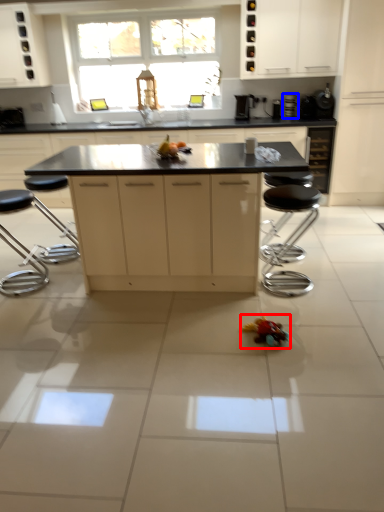
Question: Which object appears farthest to the camera in this image, toy (highlighted by a red box) or appliance (highlighted by a blue box)?

Choices:
 (A) toy
 (B) appliance

Answer: (B)